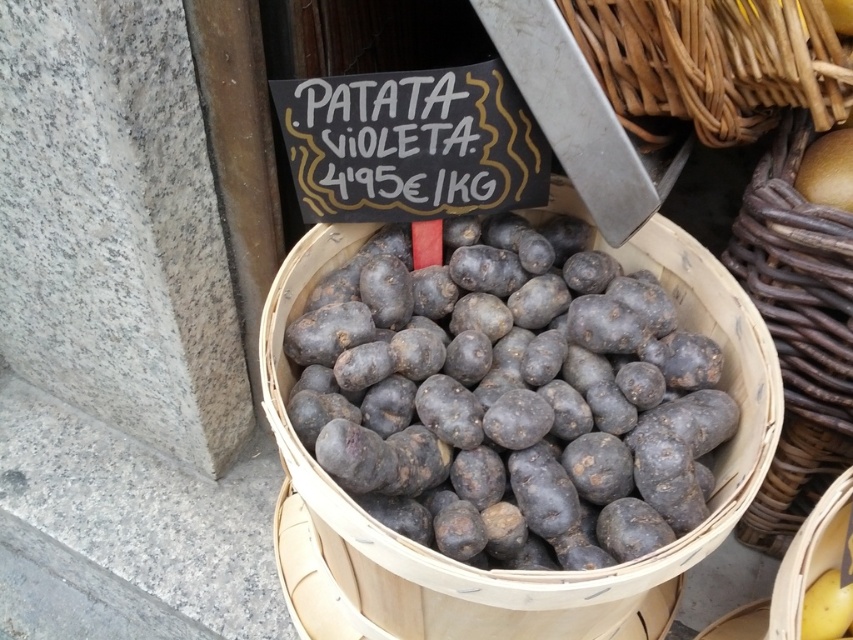
Question: Among these points, which one is nearest to the camera?

Choices:
 (A) (767, 122)
 (B) (718, 355)

Answer: (B)

Question: Which is nearer to the matte purple potatoes at center?

Choices:
 (A) woven brown basket at upper right
 (B) rustic wicker basket at center

Answer: (A)

Question: Can you confirm if matte purple potatoes at center is bigger than rustic wicker basket at center?

Choices:
 (A) no
 (B) yes

Answer: (A)

Question: From the image, what is the correct spatial relationship of rustic wicker basket at center in relation to woven brown basket at upper right?

Choices:
 (A) right
 (B) left

Answer: (A)

Question: Does matte purple potatoes at center have a greater width compared to woven brown basket at upper right?

Choices:
 (A) no
 (B) yes

Answer: (B)

Question: Which is nearer to the woven brown basket at upper right?

Choices:
 (A) matte purple potatoes at center
 (B) rustic wicker basket at center

Answer: (B)